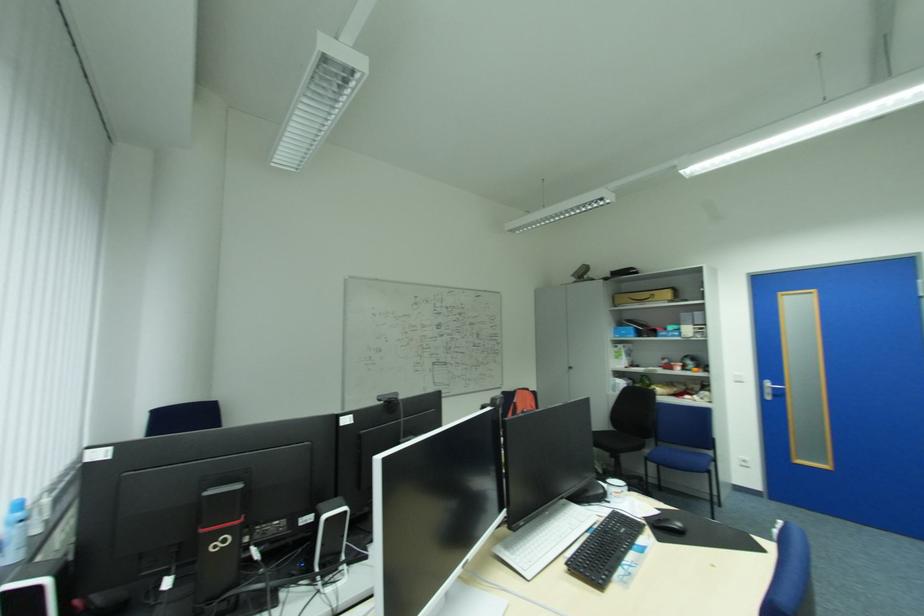
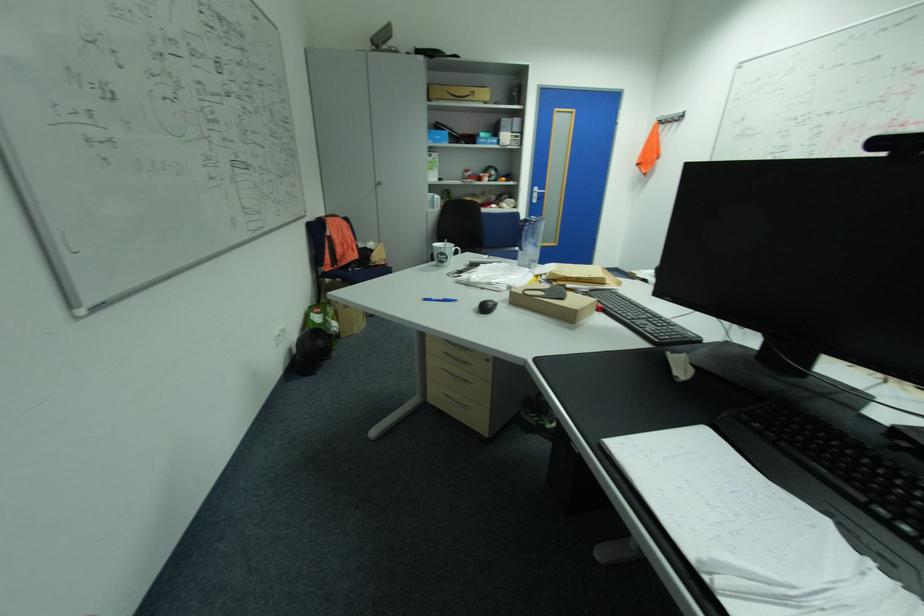
Question: I am providing you with two images of the same scene from different viewpoints. Which of the following objects are not visible in image2?

Choices:
 (A) black computer mouse
 (B) polka dot mug
 (C) blue pen
 (D) printed white mug

Answer: (A)